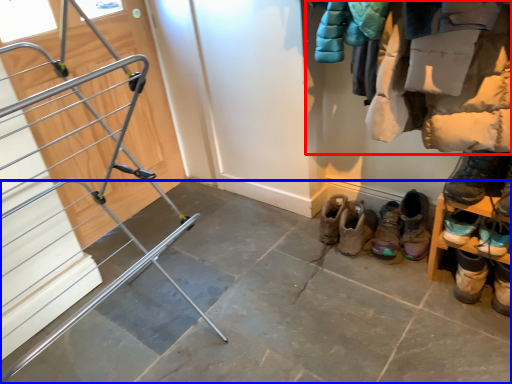
Question: Which object is closer to the camera taking this photo, closet (highlighted by a red box) or concrete (highlighted by a blue box)?

Choices:
 (A) closet
 (B) concrete

Answer: (B)